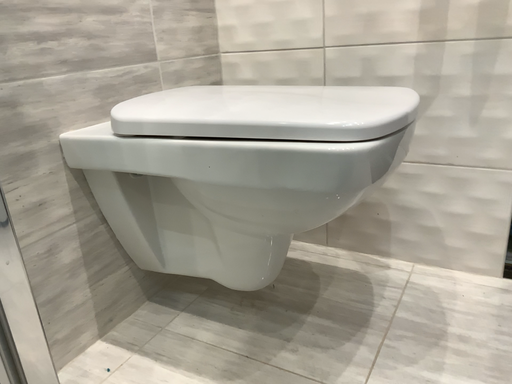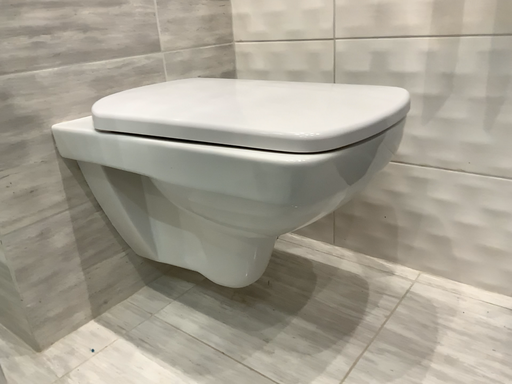
Question: Which way did the camera rotate in the video?

Choices:
 (A) rotated left
 (B) rotated right

Answer: (A)